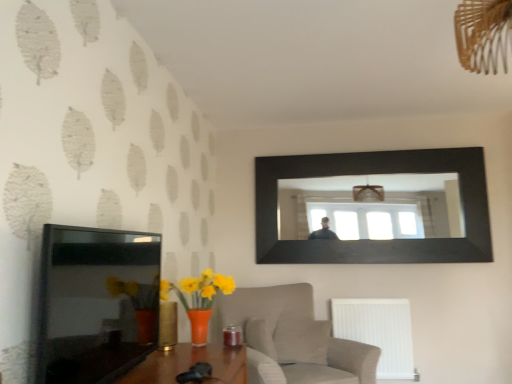
Question: Can you confirm if black glossy picture frame at upper center, the 1th picture frame positioned from the right, is shorter than textured beige armchair at lower center?

Choices:
 (A) no
 (B) yes

Answer: (A)

Question: Could you tell me if black glossy picture frame at upper center, the 1th picture frame positioned from the right, is turned towards textured beige armchair at lower center?

Choices:
 (A) no
 (B) yes

Answer: (A)

Question: Does black glossy picture frame at upper center, which is the 2th picture frame in left-to-right order, have a larger size compared to textured beige armchair at lower center?

Choices:
 (A) yes
 (B) no

Answer: (B)

Question: Can you confirm if black glossy picture frame at upper center, which is the first picture frame in back-to-front order, is smaller than textured beige armchair at lower center?

Choices:
 (A) yes
 (B) no

Answer: (A)

Question: Does black glossy picture frame at upper center, the 1th picture frame positioned from the right, come behind textured beige armchair at lower center?

Choices:
 (A) yes
 (B) no

Answer: (A)

Question: Does black glossy picture frame at upper center, which is the 2th picture frame in left-to-right order, have a greater width compared to textured beige armchair at lower center?

Choices:
 (A) yes
 (B) no

Answer: (B)

Question: Is black glossy picture frame at upper center, the 1th picture frame positioned from the right, oriented towards white plastic radiator at lower right?

Choices:
 (A) no
 (B) yes

Answer: (A)

Question: Considering the relative sizes of black glossy picture frame at upper center, which is the first picture frame in back-to-front order, and white plastic radiator at lower right in the image provided, is black glossy picture frame at upper center, which is the first picture frame in back-to-front order, thinner than white plastic radiator at lower right?

Choices:
 (A) yes
 (B) no

Answer: (A)

Question: Is black glossy picture frame at upper center, which is the 2th picture frame in left-to-right order, looking in the opposite direction of white plastic radiator at lower right?

Choices:
 (A) yes
 (B) no

Answer: (B)

Question: Does black glossy picture frame at upper center, which is the 2th picture frame in left-to-right order, appear on the right side of white plastic radiator at lower right?

Choices:
 (A) yes
 (B) no

Answer: (A)

Question: From the image's perspective, is black glossy picture frame at upper center, the 1th picture frame positioned from the right, on white plastic radiator at lower right?

Choices:
 (A) yes
 (B) no

Answer: (A)

Question: Is black glossy picture frame at upper center, the 1th picture frame positioned from the right, outside white plastic radiator at lower right?

Choices:
 (A) no
 (B) yes

Answer: (B)

Question: Does white plastic radiator at lower right have a lesser width compared to black glossy picture frame at upper center, which is the 2th picture frame in left-to-right order?

Choices:
 (A) no
 (B) yes

Answer: (A)